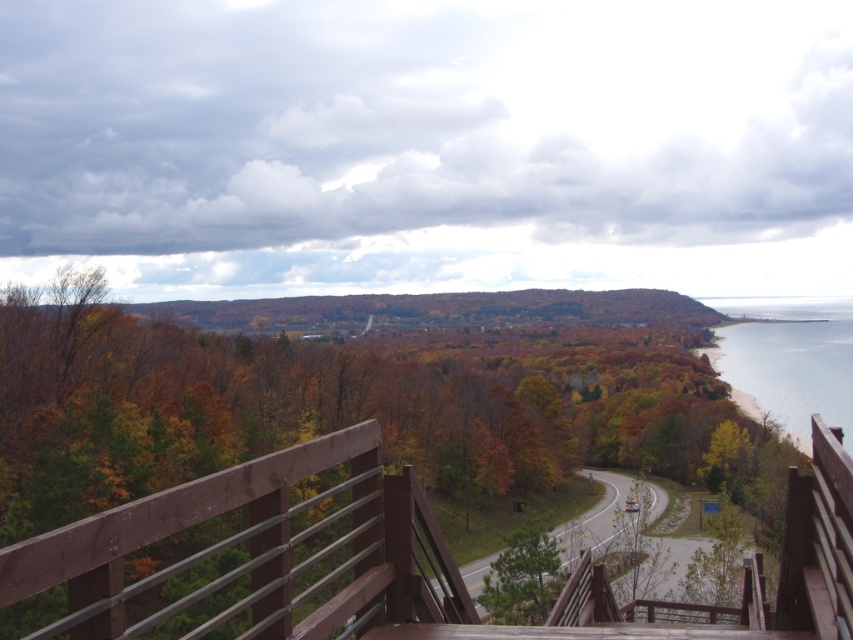
Question: Is brown wooden deck at center positioned in front of clear blue water at lower right?

Choices:
 (A) yes
 (B) no

Answer: (A)

Question: Which of the following is the closest to the observer?

Choices:
 (A) (744, 605)
 (B) (753, 412)

Answer: (A)

Question: Which point is farther to the camera?

Choices:
 (A) (779, 413)
 (B) (1, 595)

Answer: (A)

Question: Is brown wooden deck at center to the right of clear blue water at lower right from the viewer's perspective?

Choices:
 (A) yes
 (B) no

Answer: (B)

Question: Which point is farther from the camera taking this photo?

Choices:
 (A) (238, 499)
 (B) (787, 348)

Answer: (B)

Question: Does brown wooden deck at center appear under clear blue water at lower right?

Choices:
 (A) yes
 (B) no

Answer: (A)